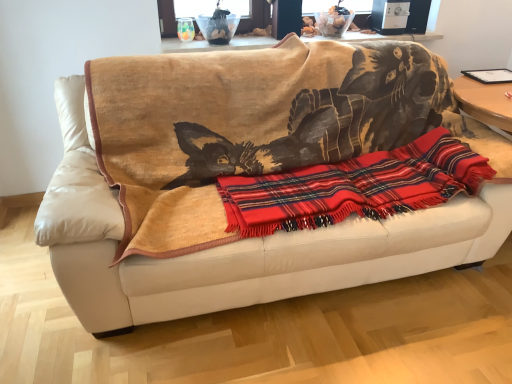
Question: Is wooden table at upper center smaller than red plaid blanket at center?

Choices:
 (A) yes
 (B) no

Answer: (A)

Question: Is wooden table at upper center facing towards red plaid blanket at center?

Choices:
 (A) no
 (B) yes

Answer: (A)

Question: Does wooden table at upper center lie in front of red plaid blanket at center?

Choices:
 (A) yes
 (B) no

Answer: (B)

Question: From the image's perspective, is wooden table at upper center beneath red plaid blanket at center?

Choices:
 (A) yes
 (B) no

Answer: (B)

Question: Is wooden table at upper center positioned beyond the bounds of red plaid blanket at center?

Choices:
 (A) yes
 (B) no

Answer: (A)

Question: Does point (483, 147) appear closer or farther from the camera than point (372, 36)?

Choices:
 (A) farther
 (B) closer

Answer: (B)

Question: From the image's perspective, relative to wooden table at upper center, is beige leather couch at center above or below?

Choices:
 (A) above
 (B) below

Answer: (B)

Question: From a real-world perspective, is beige leather couch at center positioned above or below wooden table at upper center?

Choices:
 (A) above
 (B) below

Answer: (B)

Question: Is beige leather couch at center taller or shorter than wooden table at upper center?

Choices:
 (A) short
 (B) tall

Answer: (B)

Question: From the image's perspective, is red plaid blanket at center located above or below wooden table at upper center?

Choices:
 (A) below
 (B) above

Answer: (A)

Question: Does point (238, 225) appear closer or farther from the camera than point (237, 44)?

Choices:
 (A) closer
 (B) farther

Answer: (A)

Question: Choose the correct answer: Is red plaid blanket at center inside wooden table at upper center or outside it?

Choices:
 (A) outside
 (B) inside

Answer: (A)

Question: Looking at the image, does red plaid blanket at center seem bigger or smaller compared to wooden table at upper center?

Choices:
 (A) big
 (B) small

Answer: (A)

Question: From the image's perspective, is wooden table at upper center positioned above or below red plaid blanket at center?

Choices:
 (A) above
 (B) below

Answer: (A)

Question: Would you say wooden table at upper center is to the left or to the right of red plaid blanket at center in the picture?

Choices:
 (A) right
 (B) left

Answer: (B)